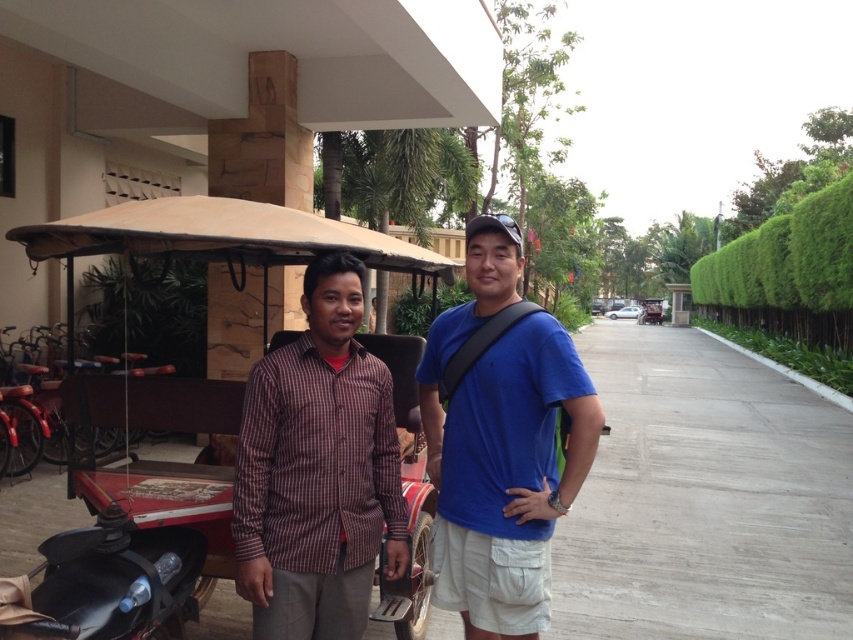
Can you confirm if blue matte shirt at center is smaller than brown checkered shirt at center?

Actually, blue matte shirt at center might be larger than brown checkered shirt at center.

Which of these two, blue matte shirt at center or brown checkered shirt at center, stands taller?

blue matte shirt at center

Identify the location of blue matte shirt at center. (500, 440).

Does point (85, 486) lie in front of point (346, 499)?

No, it is not.

Based on the photo, is wooden cart at left in front of brown checkered shirt at center?

No.

Measure the distance between wooden cart at left and camera.

They are 2.20 meters apart.

Identify the location of wooden cart at left. (132, 552).

Does wooden cart at left have a larger size compared to blue matte shirt at center?

Yes, wooden cart at left is bigger than blue matte shirt at center.

Does wooden cart at left appear over blue matte shirt at center?

Yes.

Is point (47, 621) more distant than point (463, 464)?

No, (47, 621) is in front of (463, 464).

This screenshot has height=640, width=853. I want to click on wooden cart at left, so click(132, 552).